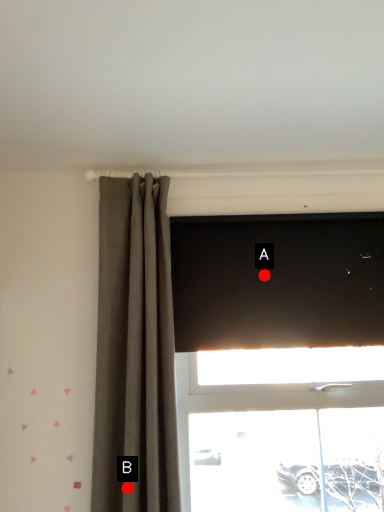
Question: Two points are circled on the image, labeled by A and B beside each circle. Which of the following is the closest to the observer?

Choices:
 (A) A is closer
 (B) B is closer

Answer: (B)